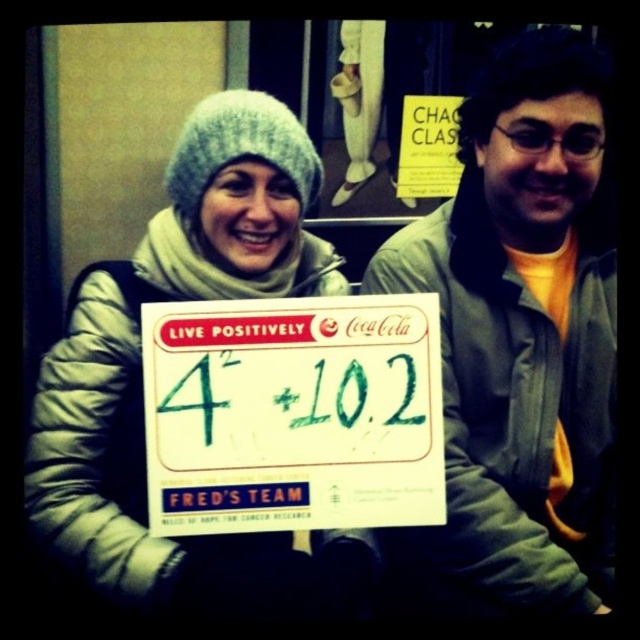
Question: Among these points, which one is farthest from the camera?

Choices:
 (A) (467, 593)
 (B) (241, 538)
 (C) (252, 316)

Answer: (A)

Question: Is green matte sign at right further to camera compared to white knit hat at upper left?

Choices:
 (A) no
 (B) yes

Answer: (A)

Question: Does white knit hat at upper left come behind white paper sign at center?

Choices:
 (A) yes
 (B) no

Answer: (A)

Question: Is white knit hat at upper left to the right of white paper sign at center from the viewer's perspective?

Choices:
 (A) yes
 (B) no

Answer: (B)

Question: Which of the following is the closest to the observer?

Choices:
 (A) (136, 518)
 (B) (314, 513)

Answer: (B)

Question: Which object appears farthest from the camera in this image?

Choices:
 (A) white paper sign at center
 (B) white knit hat at upper left
 (C) green matte sign at right

Answer: (B)